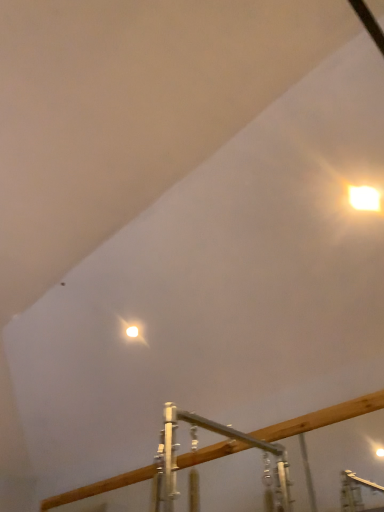
This screenshot has height=512, width=384. Identify the location of bright yellow plastic street light at upper right. (364, 198).

What do you see at coordinates (364, 198) in the screenshot?
I see `bright yellow plastic street light at upper right` at bounding box center [364, 198].

The width and height of the screenshot is (384, 512). I want to click on bright yellow plastic street light at upper right, so click(x=364, y=198).